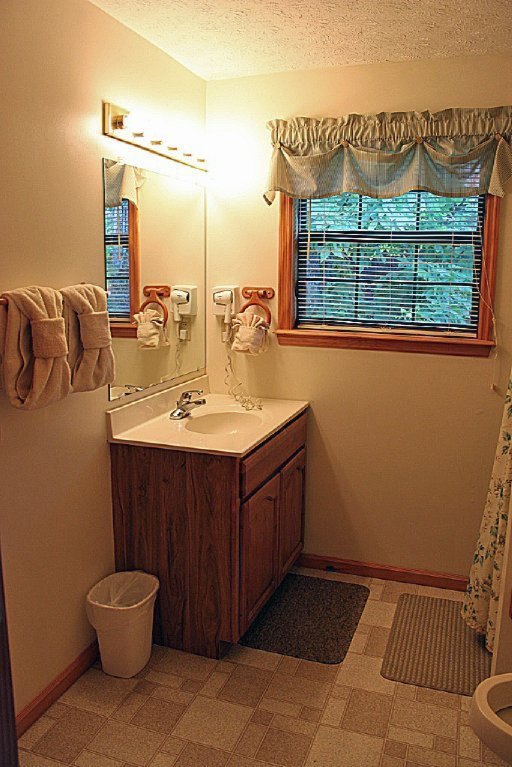
Identify the location of tile. (362, 527), (276, 729).